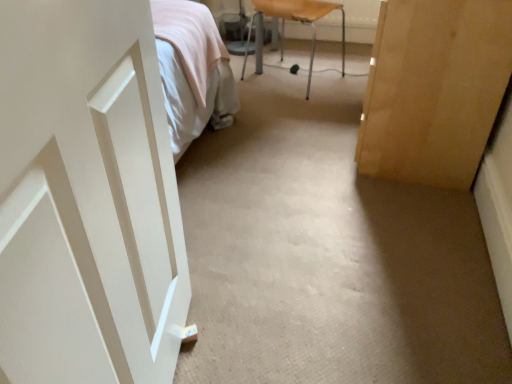
Identify the location of free spot in front of metallic silver chair at upper center. (294, 114).